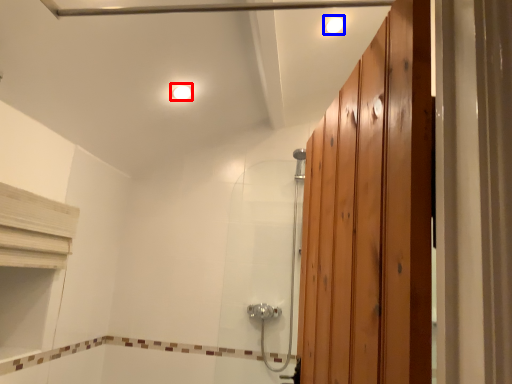
Question: Which point is further to the camera, light fixture (highlighted by a red box) or light fixture (highlighted by a blue box)?

Choices:
 (A) light fixture
 (B) light fixture

Answer: (A)